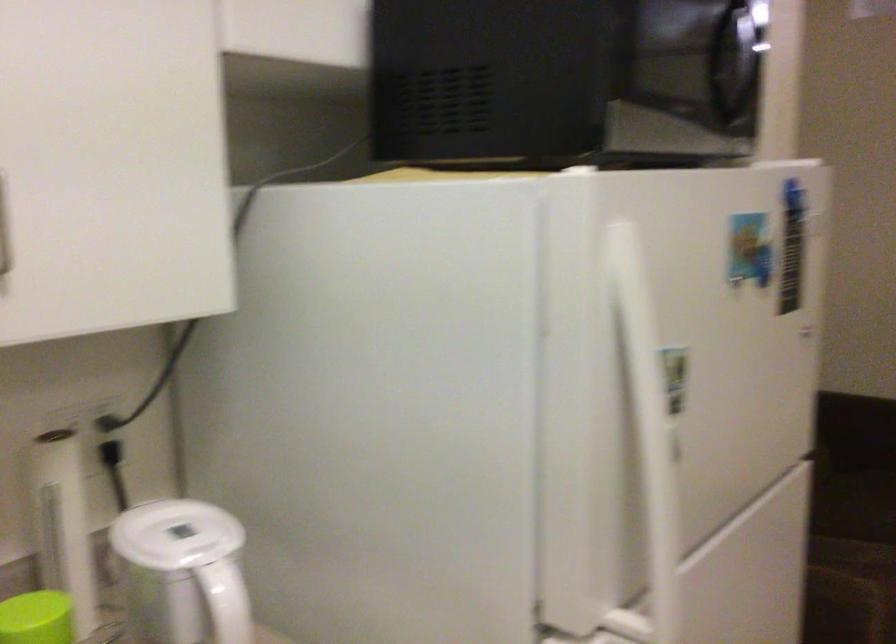
Image resolution: width=896 pixels, height=644 pixels. What are the coordinates of `cabinet door handle` in the screenshot? It's located at (4, 231).